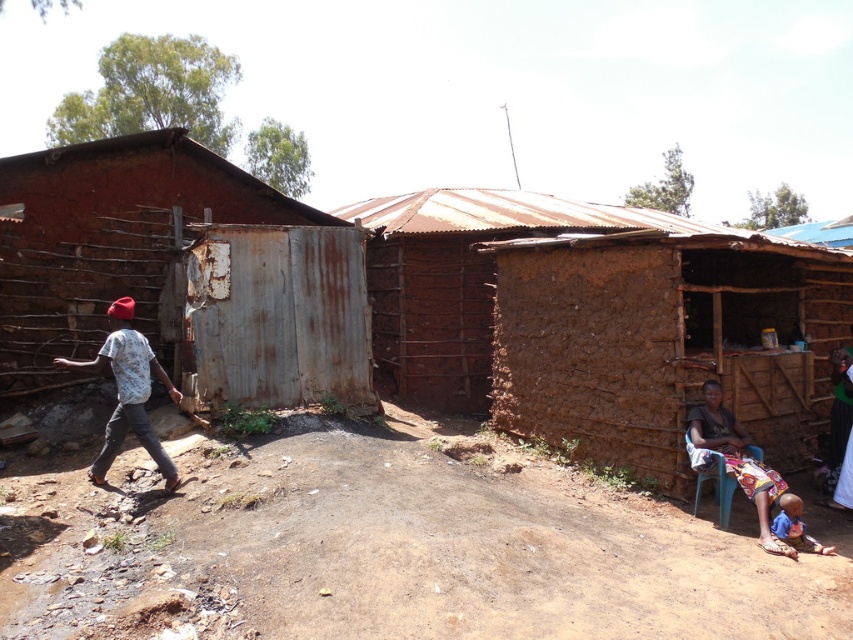
Does point (804, 269) lie in front of point (704, 388)?

No, (804, 269) is further to viewer.

Which of these two, brown mud hut at right or printed fabric skirt at lower right, stands taller?

brown mud hut at right is taller.

Describe the element at coordinates (660, 342) in the screenshot. Image resolution: width=853 pixels, height=640 pixels. I see `brown mud hut at right` at that location.

The image size is (853, 640). What are the coordinates of `brown mud hut at right` in the screenshot? It's located at (660, 342).

Is brown mud hut at right thinner than green fabric dress at lower right?

No.

Between brown mud hut at right and green fabric dress at lower right, which one is positioned lower?

Positioned lower is green fabric dress at lower right.

I want to click on brown mud hut at right, so click(x=660, y=342).

Identify the location of brown mud hut at right. The image size is (853, 640). (660, 342).

From the picture: Who is taller, printed fabric skirt at lower right or green fabric dress at lower right?

printed fabric skirt at lower right

Is printed fabric skirt at lower right thinner than green fabric dress at lower right?

No.

The height and width of the screenshot is (640, 853). In order to click on printed fabric skirt at lower right in this screenshot , I will do `click(735, 460)`.

At what (x,y) coordinates should I click in order to perform the action: click on printed fabric skirt at lower right. Please return your answer as a coordinate pair (x, y). The image size is (853, 640). Looking at the image, I should click on (735, 460).